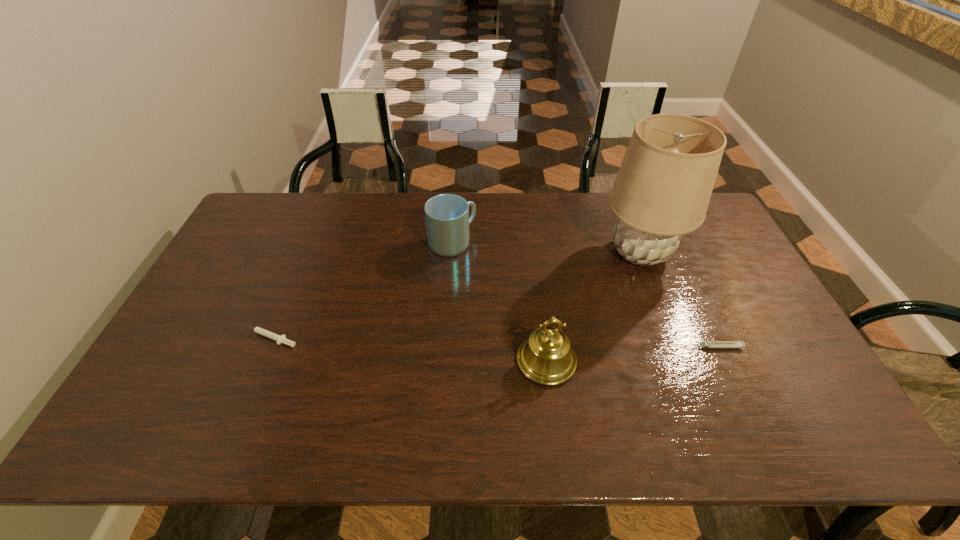
I want to click on vacant area located at the needle end of the right syringe, so [x=636, y=347].

What are the coordinates of `blank space located 0.380m on the right of the left syringe` in the screenshot? It's located at (441, 338).

Where is `lampshade positioned at the far edge`? lampshade positioned at the far edge is located at coordinates (662, 190).

Image resolution: width=960 pixels, height=540 pixels. What are the coordinates of `mug that is at the far edge` in the screenshot? It's located at (447, 219).

Find the location of a particular element. This screenshot has height=540, width=960. object present at the right edge is located at coordinates (739, 344).

Identify the location of vacant space at the far edge of the desktop. The width and height of the screenshot is (960, 540). (396, 224).

Locate an element on the screen. This screenshot has height=540, width=960. free space at the near edge of the desktop is located at coordinates (720, 421).

Where is `vacant space at the left edge of the desktop`? vacant space at the left edge of the desktop is located at coordinates (231, 287).

You are a GUI agent. You are given a task and a screenshot of the screen. Output one action in this format:
    pyautogui.click(x=<x>, y=<y>)
    Task: Click on the vacant space at the right edge of the desktop
    The height and width of the screenshot is (540, 960).
    Given the screenshot: What is the action you would take?
    pyautogui.click(x=720, y=257)

Where is `free space at the near right corner`? free space at the near right corner is located at coordinates (839, 439).